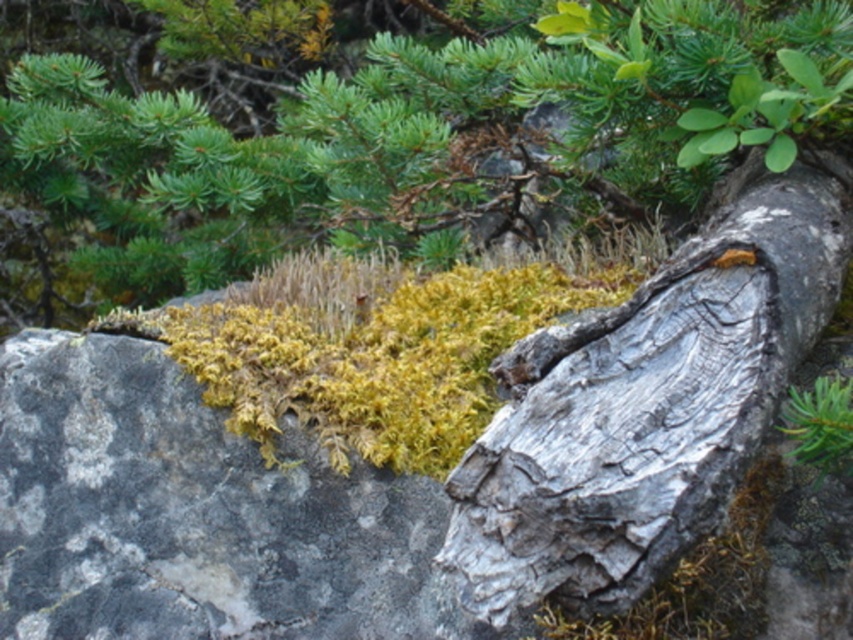
Question: Which object appears closest to the camera in this image?

Choices:
 (A) gray rough bark tree trunk at center
 (B) green leafy plant at upper right
 (C) yellow-green moss at center
 (D) green leafy tree at upper center

Answer: (B)

Question: Does green leafy tree at upper center appear on the left side of gray rough bark tree trunk at center?

Choices:
 (A) yes
 (B) no

Answer: (A)

Question: Which point appears farthest from the camera in this image?

Choices:
 (A) (786, 410)
 (B) (314, 376)
 (C) (553, 340)

Answer: (B)

Question: Considering the relative positions of green leafy tree at upper center and yellow-green moss at center in the image provided, where is green leafy tree at upper center located with respect to yellow-green moss at center?

Choices:
 (A) above
 (B) below

Answer: (A)

Question: Which of the following is the closest to the observer?

Choices:
 (A) (802, 413)
 (B) (817, 268)

Answer: (A)

Question: Where is green leafy tree at upper center located in relation to yellow-green moss at center in the image?

Choices:
 (A) below
 (B) above

Answer: (B)